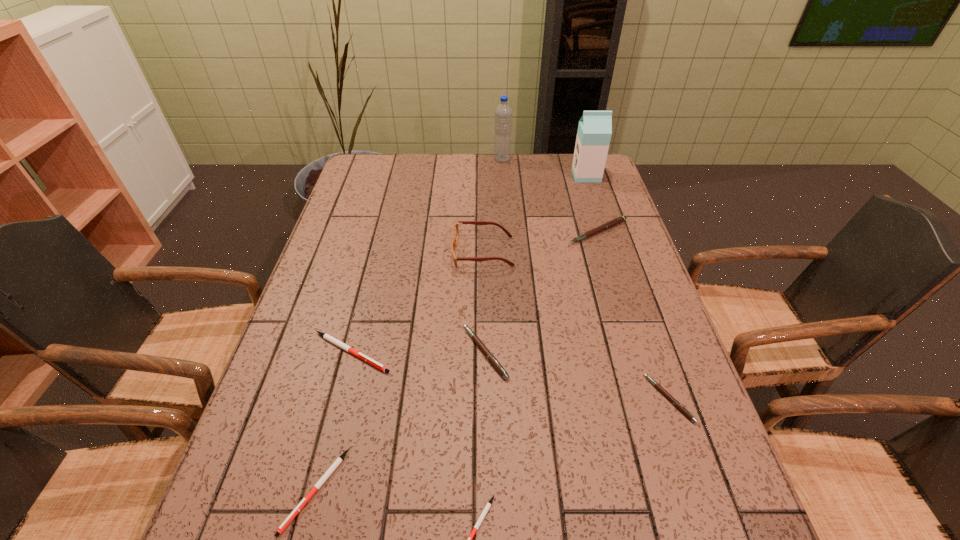
The height and width of the screenshot is (540, 960). Identify the location of vacant space located at the nib of the leftmost pink pen. (303, 353).

Where is `free spot located 0.210m on the clicker of the farthest white pen`? free spot located 0.210m on the clicker of the farthest white pen is located at coordinates (485, 353).

Where is `vacant position located at the nib of the smallest pink pen`? vacant position located at the nib of the smallest pink pen is located at coordinates (604, 399).

Where is `free region located at the nib of the smallest pink pen`? free region located at the nib of the smallest pink pen is located at coordinates (589, 399).

The width and height of the screenshot is (960, 540). Identify the location of free space located at the nib of the smallest pink pen. (570, 399).

The width and height of the screenshot is (960, 540). In order to click on water bottle positioned at the far edge in this screenshot , I will do `click(503, 112)`.

You are a GUI agent. You are given a task and a screenshot of the screen. Output one action in this format:
    pyautogui.click(x=<x>, y=<y>)
    Task: Click on the milk carton at the far edge
    
    Given the screenshot: What is the action you would take?
    pyautogui.click(x=594, y=132)

This screenshot has width=960, height=540. I want to click on object positioned at the near edge, so click(x=288, y=520).

This screenshot has width=960, height=540. Find the location of `milk carton that is at the right edge`. milk carton that is at the right edge is located at coordinates 594,132.

Where is `object positioned at the near left corner`? object positioned at the near left corner is located at coordinates (288, 520).